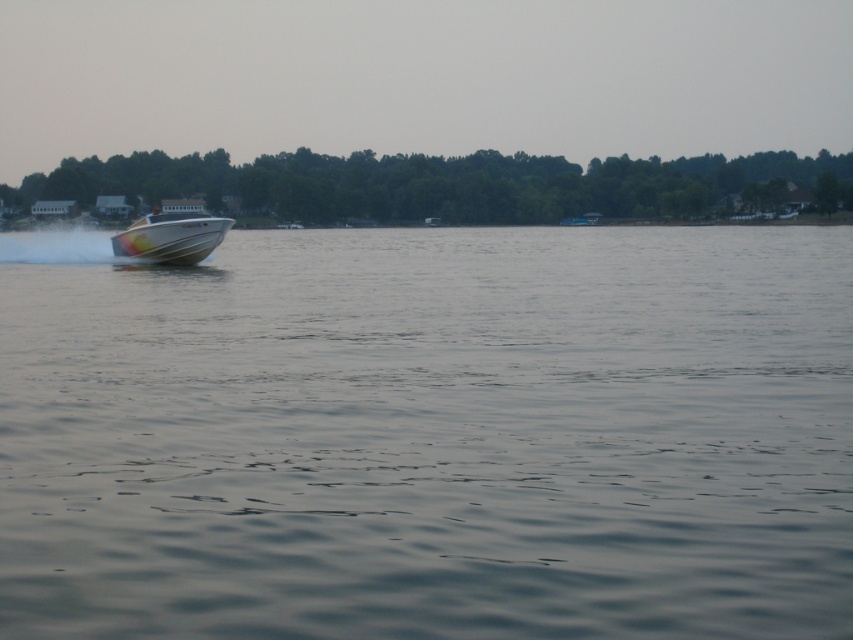
You are standing on the dock and see the point marked at coordinates (x=430, y=435). What is the condition of the water at that point?

The point at (x=430, y=435) is on clear water at center, so the water there is clear and not obstructed by any objects.

You are a photographer trying to capture the white glossy boat at left and the clear water at center in a single shot. Based on their heights, which object will appear larger in the photo?

The white glossy boat at left will appear larger in the photo because it is taller than the clear water at center.